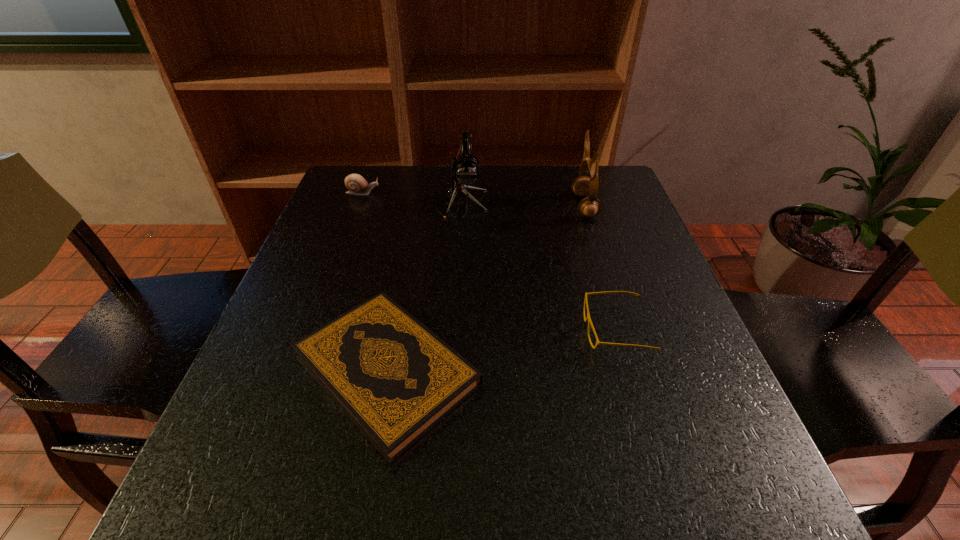
Locate an element on the screen. This screenshot has height=540, width=960. vacant point located between the shortest object and the left earphone is located at coordinates (425, 287).

Locate an element on the screen. free space between the second shortest object and the right earphone is located at coordinates (600, 268).

At what (x,y) coordinates should I click in order to perform the action: click on free point between the hardback book and the fourth tallest object. Please return your answer as a coordinate pair (x, y). Looking at the image, I should click on (501, 350).

The height and width of the screenshot is (540, 960). I want to click on vacant space that is in between the escargot and the spectacles, so click(490, 261).

Locate an element on the screen. free point between the right earphone and the fourth tallest object is located at coordinates (600, 268).

This screenshot has width=960, height=540. Find the location of `free area in between the spectacles and the third tallest object`. free area in between the spectacles and the third tallest object is located at coordinates (490, 261).

At what (x,y) coordinates should I click in order to perform the action: click on free space between the shortest object and the escargot. Please return your answer as a coordinate pair (x, y). This screenshot has height=540, width=960. Looking at the image, I should click on (375, 281).

Identify which object is located as the third nearest to the left earphone. Please provide its 2D coordinates. Your answer should be formatted as a tuple, i.e. [(x, y)], where the tuple contains the x and y coordinates of a point satisfying the conditions above.

[(395, 379)]

Identify which object is the fourth nearest to the left earphone. Please provide its 2D coordinates. Your answer should be formatted as a tuple, i.e. [(x, y)], where the tuple contains the x and y coordinates of a point satisfying the conditions above.

[(588, 318)]

Identify the location of vacant space that satisfies the following two spatial constraints: 1. on the front-facing side of the shortest object; 2. on the right side of the third shortest object. (297, 370).